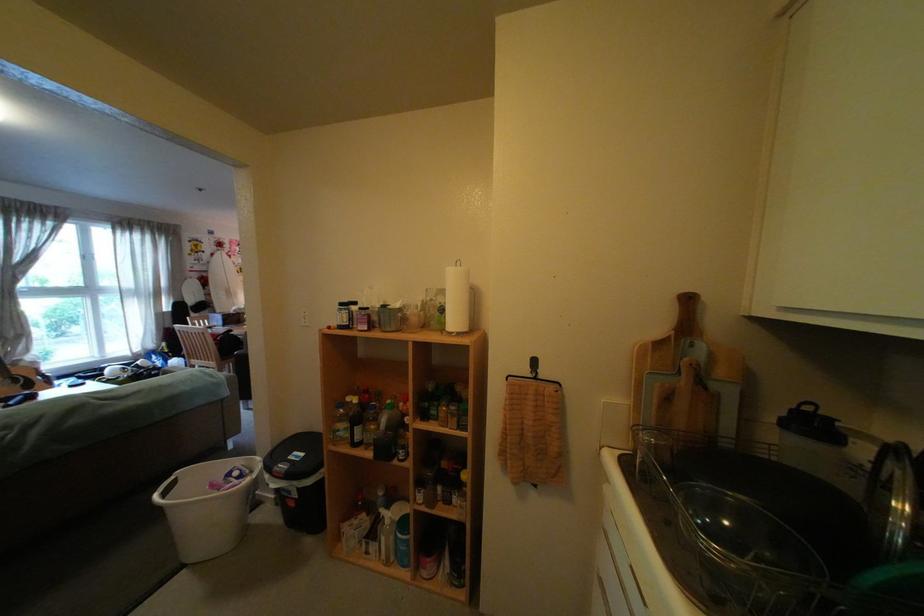
Find the location of `spray bottle trigger`. spray bottle trigger is located at coordinates (403, 525).